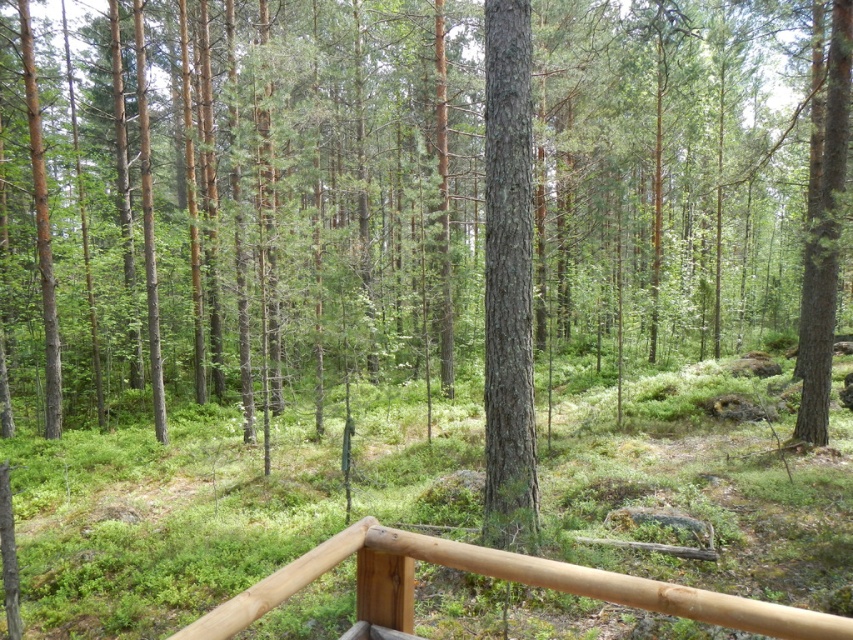
Question: Does smooth bark tree at center have a greater width compared to smooth bark tree at right?

Choices:
 (A) no
 (B) yes

Answer: (B)

Question: Estimate the real-world distances between objects in this image. Which object is farther from the brown wooden rail at center?

Choices:
 (A) smooth bark tree at center
 (B) smooth bark tree at right

Answer: (B)

Question: Can you confirm if brown wooden rail at center is bigger than smooth bark tree at right?

Choices:
 (A) yes
 (B) no

Answer: (A)

Question: Estimate the real-world distances between objects in this image. Which object is closer to the smooth bark tree at center?

Choices:
 (A) smooth bark tree at right
 (B) brown wooden rail at center

Answer: (B)

Question: Estimate the real-world distances between objects in this image. Which object is farther from the smooth bark tree at right?

Choices:
 (A) brown wooden rail at center
 (B) smooth bark tree at center

Answer: (A)

Question: Is smooth bark tree at center below smooth bark tree at right?

Choices:
 (A) yes
 (B) no

Answer: (A)